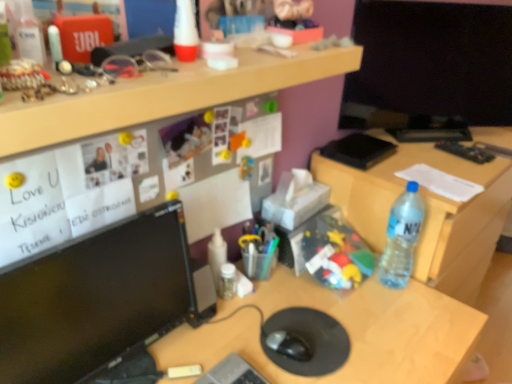
You are a GUI agent. You are given a task and a screenshot of the screen. Output one action in this format:
    pyautogui.click(x=<x>, y=<y>)
    Task: Click on the free space in front of black matte mouse at center
    This screenshot has width=512, height=384.
    Given the screenshot: What is the action you would take?
    click(x=289, y=371)